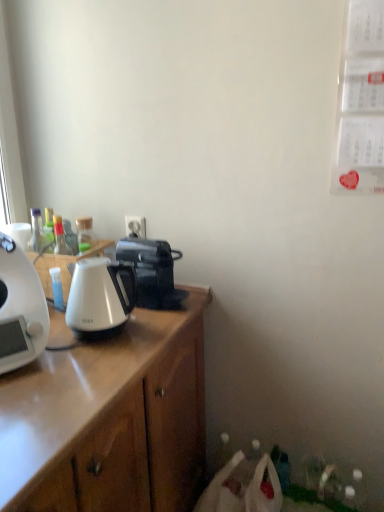
Measure the distance between white glossy kettle at left and camera.

A distance of 3.82 feet exists between white glossy kettle at left and camera.

Where is `white glossy kettle at left`? The height and width of the screenshot is (512, 384). white glossy kettle at left is located at coordinates (63, 266).

At what (x,y) coordinates should I click in order to perform the action: click on white glossy kettle at left. Please return your answer as a coordinate pair (x, y). The width and height of the screenshot is (384, 512). Looking at the image, I should click on (100, 296).

From the image's perspective, would you say white glossy kettle at left is shown under white plastic power outlet at center?

Indeed, from the image's perspective, white glossy kettle at left is shown beneath white plastic power outlet at center.

Does white glossy kettle at left have a lesser height compared to white plastic power outlet at center?

No, white glossy kettle at left is not shorter than white plastic power outlet at center.

From a real-world perspective, between white glossy kettle at left and white plastic power outlet at center, who is vertically lower?

white glossy kettle at left is physically lower.

Could you tell me if white glossy kettle at left is turned towards white plastic power outlet at center?

No, white glossy kettle at left is not oriented towards white plastic power outlet at center.

Is white glossy kettle at left with white glossy kettle at left?

No, white glossy kettle at left is not in contact with white glossy kettle at left.

From the image's perspective, does white glossy kettle at left appear lower than white glossy kettle at left?

No.

Considering the positions of objects white glossy kettle at left and white glossy kettle at left in the image provided, who is behind, white glossy kettle at left or white glossy kettle at left?

white glossy kettle at left is behind.

In terms of height, does white glossy kettle at left look taller or shorter compared to white glossy kettle at left?

In the image, white glossy kettle at left appears to be taller than white glossy kettle at left.

From a real-world perspective, is black plastic coffee maker at upper center, the 1th coffee maker in the right-to-left sequence, positioned above or below white glossy kettle at left?

From a real-world perspective, black plastic coffee maker at upper center, the 1th coffee maker in the right-to-left sequence, is physically below white glossy kettle at left.

In the scene shown: Considering the relative positions of black plastic coffee maker at upper center, the 1th coffee maker in the right-to-left sequence, and white glossy kettle at left in the image provided, is black plastic coffee maker at upper center, the 1th coffee maker in the right-to-left sequence, in front of white glossy kettle at left?

That is False.

Is point (164, 254) positioned in front of point (48, 286)?

Yes, it is.

Considering the relative positions of black plastic coffee maker at upper center, marked as the 2th coffee maker in a left-to-right arrangement, and white glossy kettle at left in the image provided, is black plastic coffee maker at upper center, marked as the 2th coffee maker in a left-to-right arrangement, to the right of white glossy kettle at left from the viewer's perspective?

Yes.

Considering the positions of point (13, 330) and point (72, 263), is point (13, 330) closer or farther from the camera than point (72, 263)?

Point (13, 330) appears to be closer to the viewer than point (72, 263).

Considering the positions of objects white glossy coffee maker at left, marked as the first coffee maker in a front-to-back arrangement, and white glossy kettle at left in the image provided, who is more to the left, white glossy coffee maker at left, marked as the first coffee maker in a front-to-back arrangement, or white glossy kettle at left?

From the viewer's perspective, white glossy coffee maker at left, marked as the first coffee maker in a front-to-back arrangement, appears more on the left side.

Is white glossy coffee maker at left, placed as the second coffee maker when sorted from right to left, wider than white glossy kettle at left?

Incorrect, the width of white glossy coffee maker at left, placed as the second coffee maker when sorted from right to left, does not surpass that of white glossy kettle at left.

From the image's perspective, is white glossy coffee maker at left, positioned as the first coffee maker in left-to-right order, over white glossy kettle at left?

Actually, white glossy coffee maker at left, positioned as the first coffee maker in left-to-right order, appears below white glossy kettle at left in the image.

Between white glossy kettle at left and white glossy coffee maker at left, marked as the first coffee maker in a front-to-back arrangement, which one appears on the right side from the viewer's perspective?

white glossy kettle at left is more to the right.

How many degrees apart are the facing directions of white glossy kettle at left and white glossy coffee maker at left, marked as the first coffee maker in a front-to-back arrangement?

26.9 degrees.

Is white glossy kettle at left facing towards white glossy coffee maker at left, positioned as the first coffee maker in left-to-right order?

No, white glossy kettle at left is not turned towards white glossy coffee maker at left, positioned as the first coffee maker in left-to-right order.

Considering the points (130, 224) and (36, 269), which point is behind, point (130, 224) or point (36, 269)?

Positioned behind is point (130, 224).

In the image, is white plastic power outlet at center positioned in front of or behind white glossy kettle at left?

white plastic power outlet at center is behind white glossy kettle at left.

Is white plastic power outlet at center taller or shorter than white glossy kettle at left?

In the image, white plastic power outlet at center appears to be shorter than white glossy kettle at left.

Are white plastic power outlet at center and white glossy kettle at left far apart?

white plastic power outlet at center is near white glossy kettle at left, not far away.

From the picture: Between white glossy kettle at left and black plastic coffee maker at upper center, the 1th coffee maker in the right-to-left sequence, which one has smaller size?

Smaller between the two is black plastic coffee maker at upper center, the 1th coffee maker in the right-to-left sequence.

This screenshot has width=384, height=512. Identify the location of coffee maker lying behind the white glossy kettle at left. (152, 272).

How many degrees apart are the facing directions of white glossy kettle at left and black plastic coffee maker at upper center, marked as the 2th coffee maker in a left-to-right arrangement?

They differ by 0.402 degrees in their facing directions.

Considering their positions, is white glossy kettle at left located in front of or behind black plastic coffee maker at upper center, the second coffee maker in the front-to-back sequence?

Visually, white glossy kettle at left is located in front of black plastic coffee maker at upper center, the second coffee maker in the front-to-back sequence.

Identify the location of power outlet above the white glossy kettle at left (from the image's perspective). (135, 226).

Find the location of a particular element. This screenshot has height=512, width=384. kettle that is on the right side of white glossy kettle at left is located at coordinates (100, 296).

Based on their spatial positions, is black plastic coffee maker at upper center, the second coffee maker in the front-to-back sequence, or white glossy kettle at left closer to white glossy coffee maker at left, marked as the first coffee maker in a front-to-back arrangement?

Among the two, white glossy kettle at left is located nearer to white glossy coffee maker at left, marked as the first coffee maker in a front-to-back arrangement.

Considering their positions, is white plastic power outlet at center positioned further to white glossy kettle at left than white glossy coffee maker at left, placed as the second coffee maker when sorted from right to left?

Based on the image, white plastic power outlet at center appears to be further to white glossy kettle at left.

Looking at the image, which one is located closer to white glossy coffee maker at left, which is counted as the 2th coffee maker, starting from the back, white plastic power outlet at center or white glossy kettle at left?

white glossy kettle at left.

Which object lies further to the anchor point white glossy kettle at left, white glossy coffee maker at left, which is counted as the 2th coffee maker, starting from the back, or white plastic power outlet at center?

white plastic power outlet at center is further to white glossy kettle at left.

In the scene shown: When comparing their distances from white glossy coffee maker at left, positioned as the first coffee maker in left-to-right order, does white glossy kettle at left or white plastic power outlet at center seem further?

Based on the image, white plastic power outlet at center appears to be further to white glossy coffee maker at left, positioned as the first coffee maker in left-to-right order.

In the scene shown: When comparing their distances from white glossy kettle at left, does white glossy coffee maker at left, placed as the second coffee maker when sorted from right to left, or black plastic coffee maker at upper center, marked as the 1th coffee maker in a back-to-front arrangement, seem closer?

white glossy coffee maker at left, placed as the second coffee maker when sorted from right to left, is closer to white glossy kettle at left.

Looking at the image, which one is located closer to white plastic power outlet at center, black plastic coffee maker at upper center, marked as the 1th coffee maker in a back-to-front arrangement, or white glossy kettle at left?

Among the two, black plastic coffee maker at upper center, marked as the 1th coffee maker in a back-to-front arrangement, is located nearer to white plastic power outlet at center.

When comparing their distances from white plastic power outlet at center, does white glossy kettle at left or white glossy kettle at left seem closer?

white glossy kettle at left is closer to white plastic power outlet at center.

The width and height of the screenshot is (384, 512). I want to click on kettle between white glossy coffee maker at left, marked as the first coffee maker in a front-to-back arrangement, and black plastic coffee maker at upper center, the second coffee maker in the front-to-back sequence, in the horizontal direction, so click(100, 296).

Where is `kettle between white glossy coffee maker at left, marked as the first coffee maker in a front-to-back arrangement, and white plastic power outlet at center from front to back`? kettle between white glossy coffee maker at left, marked as the first coffee maker in a front-to-back arrangement, and white plastic power outlet at center from front to back is located at coordinates (100, 296).

Find the location of a particular element. This screenshot has width=384, height=512. desk between white glossy coffee maker at left, positioned as the first coffee maker in left-to-right order, and white plastic power outlet at center, along the z-axis is located at coordinates (63, 266).

In order to click on coffee maker between white glossy kettle at left and white plastic power outlet at center along the z-axis in this screenshot , I will do `click(152, 272)`.